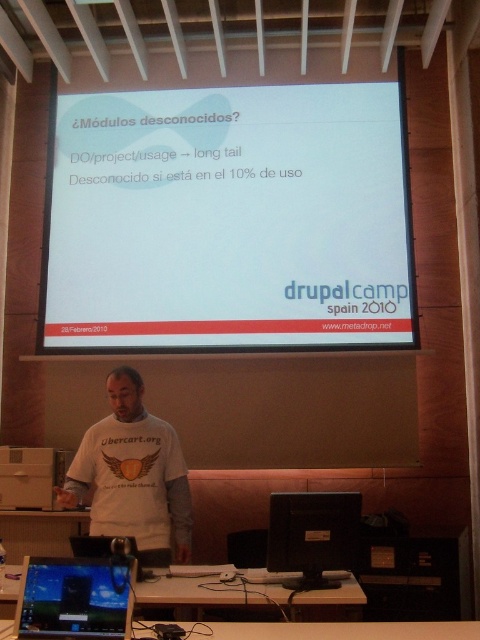
Question: Is white matte projection screen at upper center bigger than white cotton shirt at center?

Choices:
 (A) no
 (B) yes

Answer: (B)

Question: Which object appears closest to the camera in this image?

Choices:
 (A) white matte projection screen at upper center
 (B) black glossy laptop at lower left

Answer: (B)

Question: Is white matte projection screen at upper center to the left of black plastic monitor at center from the viewer's perspective?

Choices:
 (A) no
 (B) yes

Answer: (B)

Question: Considering the real-world distances, which object is closest to the white cotton shirt at center?

Choices:
 (A) white matte projection screen at upper center
 (B) black glossy laptop at lower left

Answer: (B)

Question: Can you confirm if white matte projection screen at upper center is positioned to the left of white cotton shirt at center?

Choices:
 (A) no
 (B) yes

Answer: (A)

Question: Among these points, which one is nearest to the camera?

Choices:
 (A) (266, 545)
 (B) (410, 252)
 (C) (81, 486)

Answer: (C)